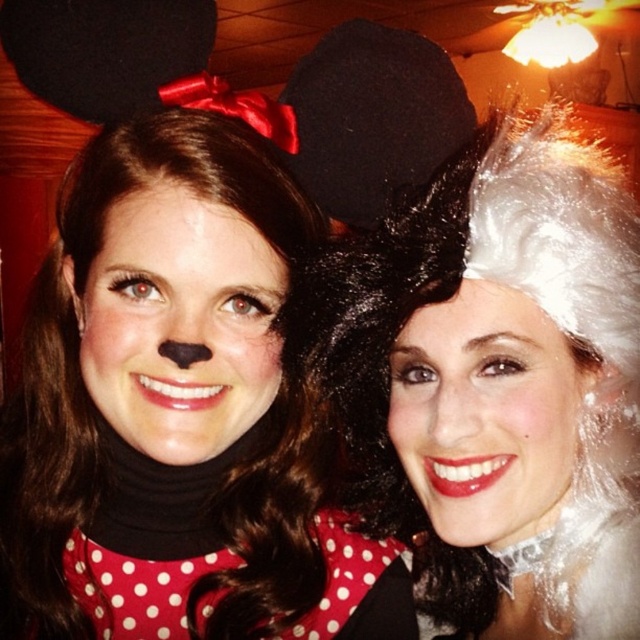
Which is above, matte black mouse ears at left or white shiny wig at upper right?

Positioned higher is white shiny wig at upper right.

You are a GUI agent. You are given a task and a screenshot of the screen. Output one action in this format:
    pyautogui.click(x=<x>, y=<y>)
    Task: Click on the matte black mouse ears at left
    The height and width of the screenshot is (640, 640).
    Given the screenshot: What is the action you would take?
    pyautogui.click(x=177, y=412)

Between point (321, 232) and point (625, 552), which one is positioned behind?

The point (321, 232) is behind.

Identify the location of matte black mouse ears at left. This screenshot has height=640, width=640. (177, 412).